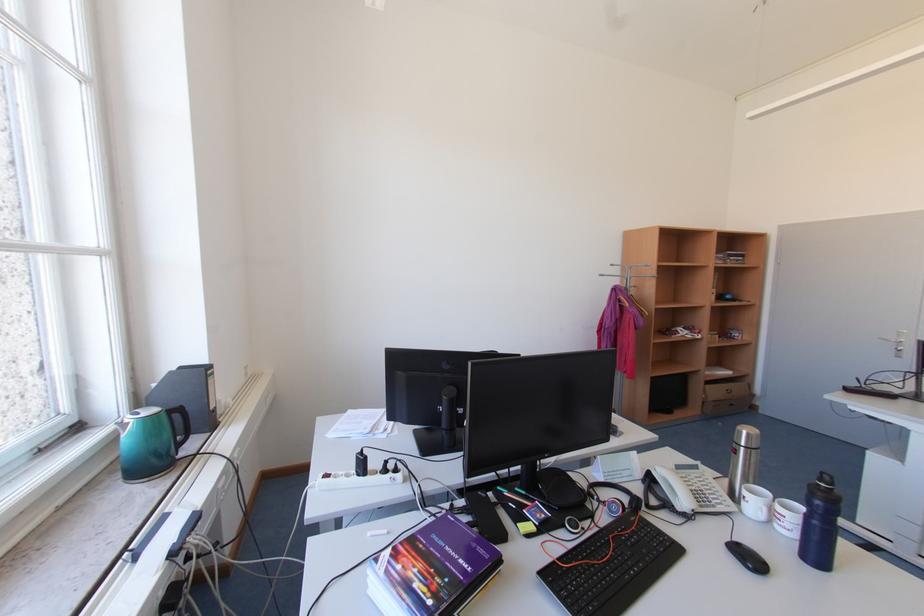
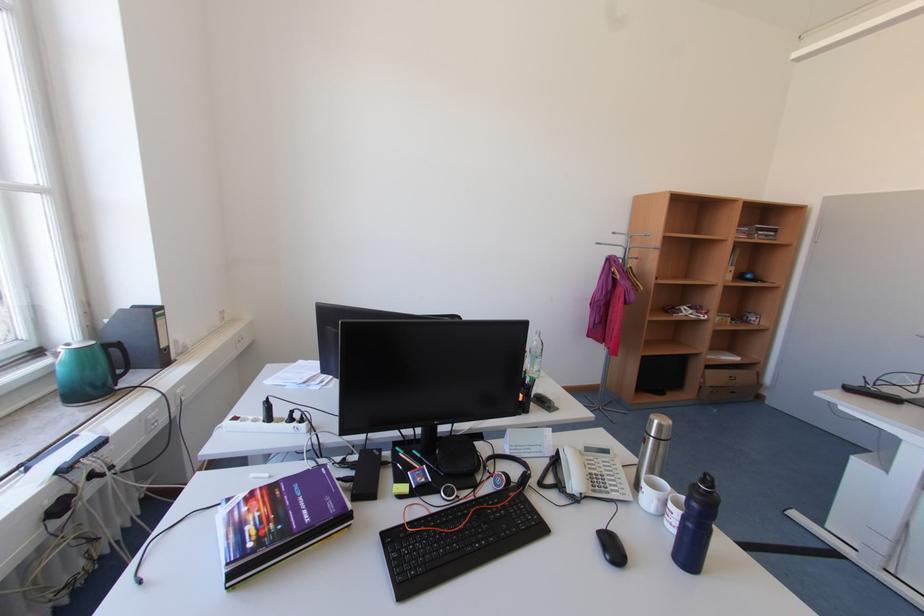
Question: In a continuous first-person perspective shot, in which direction is the camera moving?

Choices:
 (A) Left
 (B) Right
 (C) Forward
 (D) Backward

Answer: (B)